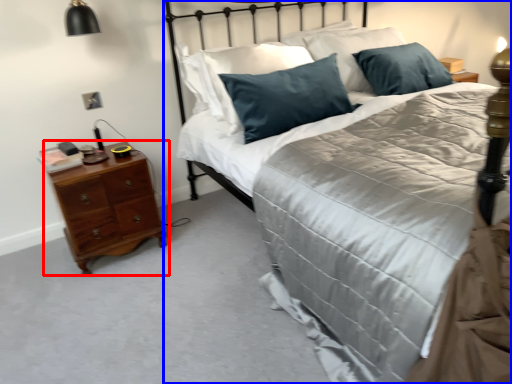
Question: Which of the following is the closest to the observer, nightstand (highlighted by a red box) or bed (highlighted by a blue box)?

Choices:
 (A) nightstand
 (B) bed

Answer: (B)